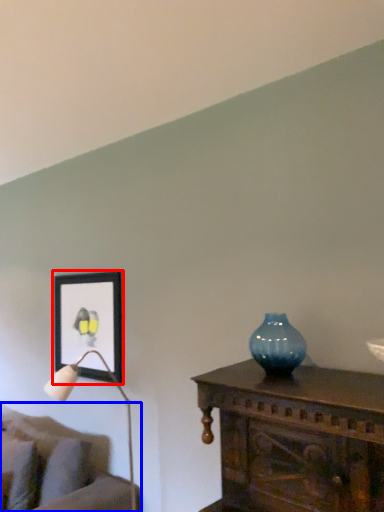
Question: Which point is further to the camera, picture frame (highlighted by a red box) or studio couch (highlighted by a blue box)?

Choices:
 (A) picture frame
 (B) studio couch

Answer: (A)